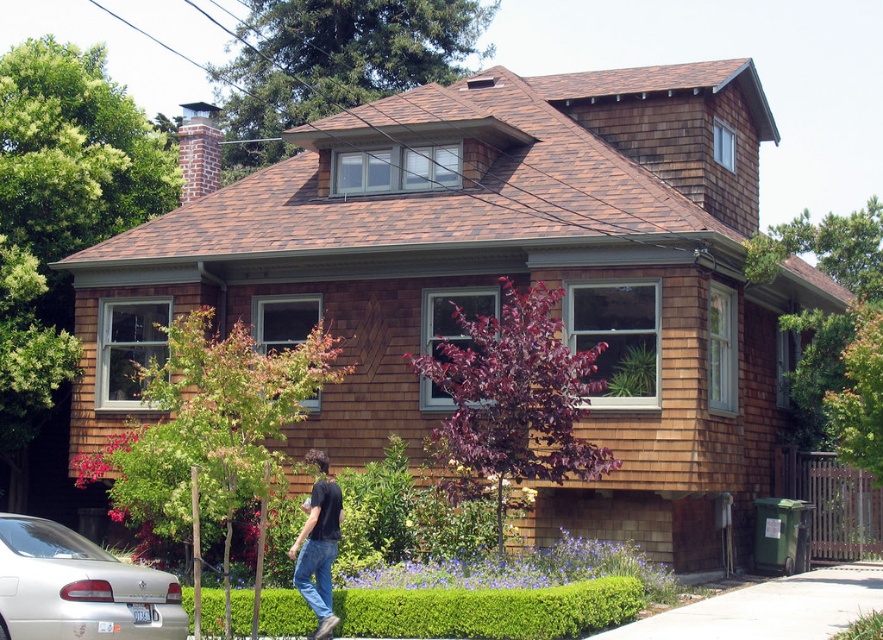
Is green leafy hedge at lower center above black cotton shirt at lower center?

Actually, green leafy hedge at lower center is below black cotton shirt at lower center.

Between point (522, 605) and point (325, 577), which one is positioned behind?

Positioned behind is point (325, 577).

Locate an element on the screen. The width and height of the screenshot is (883, 640). green leafy hedge at lower center is located at coordinates (489, 611).

Is silver metallic car at lower left above black cotton shirt at lower center?

Yes.

Is point (34, 608) more distant than point (310, 557)?

That is False.

Which is in front, point (103, 556) or point (331, 544)?

Point (103, 556) is in front.

The width and height of the screenshot is (883, 640). In order to click on silver metallic car at lower left in this screenshot , I will do `click(78, 588)`.

Find the location of `silver metallic car at lower left`. silver metallic car at lower left is located at coordinates (78, 588).

Locate an element on the screen. silver metallic car at lower left is located at coordinates (78, 588).